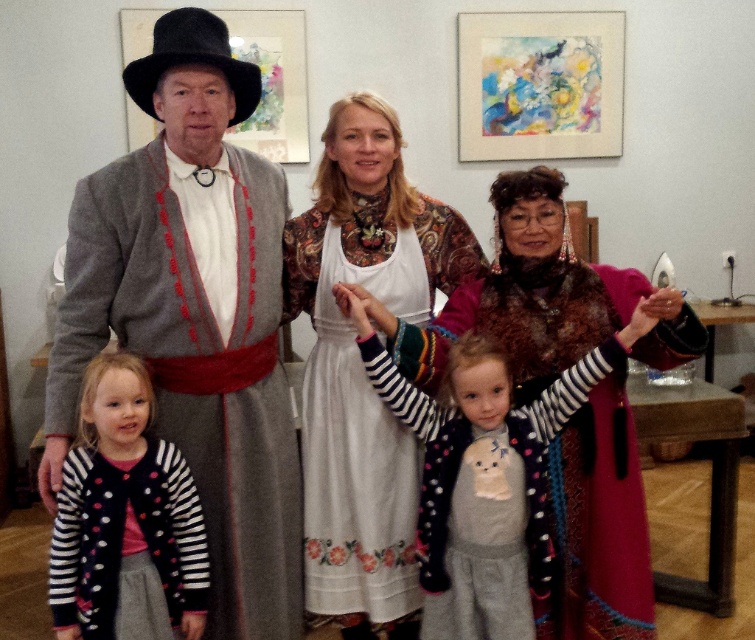
Can you confirm if white cotton dress at center is positioned to the right of velvet maroon coat at center?

Incorrect, white cotton dress at center is not on the right side of velvet maroon coat at center.

Can you confirm if white cotton dress at center is smaller than velvet maroon coat at center?

Yes.

Locate an element on the screen. Image resolution: width=755 pixels, height=640 pixels. white cotton dress at center is located at coordinates (359, 362).

Is white cotton dress at center smaller than striped knit sweater at center?

No, white cotton dress at center is not smaller than striped knit sweater at center.

Describe the element at coordinates (359, 362) in the screenshot. The height and width of the screenshot is (640, 755). I see `white cotton dress at center` at that location.

Between point (461, 237) and point (522, 595), which one is positioned in front?

Point (522, 595) is in front.

The width and height of the screenshot is (755, 640). Identify the location of white cotton dress at center. (359, 362).

Who is more distant from viewer, (x=190, y=387) or (x=365, y=625)?

The point (x=365, y=625) is more distant.

Looking at this image, measure the distance between matte gray coat at left and camera.

1.72 meters

Which is behind, point (71, 227) or point (362, 378)?

The point (362, 378) is more distant.

Image resolution: width=755 pixels, height=640 pixels. I want to click on matte gray coat at left, so click(x=193, y=314).